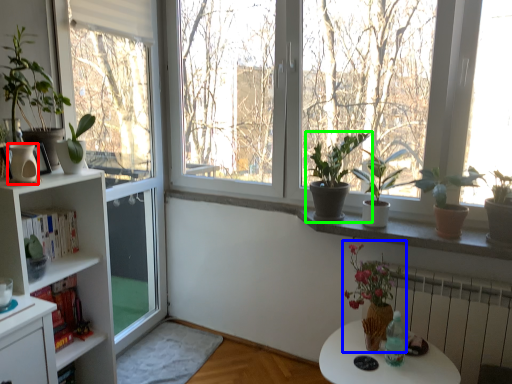
Question: Considering the real-world distances, which object is farthest from vase (highlighted by a red box)? floral arrangement (highlighted by a blue box) or houseplant (highlighted by a green box)?

Choices:
 (A) floral arrangement
 (B) houseplant

Answer: (A)